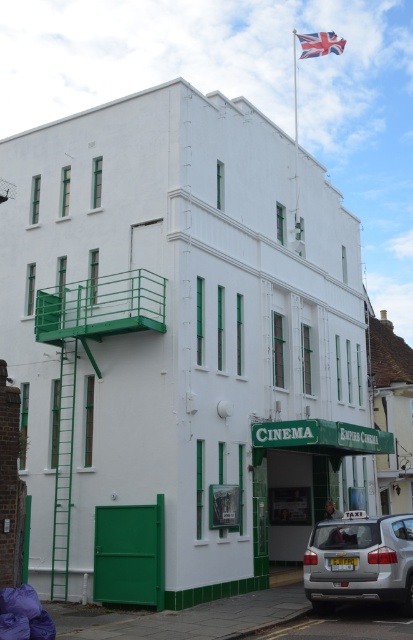
Consider the image. Who is more forward, [358,579] or [330,45]?

Point [358,579] is in front.

Between silver metallic taxi at lower right and union jack fabric at upper center, which one is positioned higher?

union jack fabric at upper center is above.

Between point (320, 531) and point (315, 45), which one is positioned in front?

Positioned in front is point (320, 531).

Where is `silver metallic taxi at lower right`? silver metallic taxi at lower right is located at coordinates (360, 561).